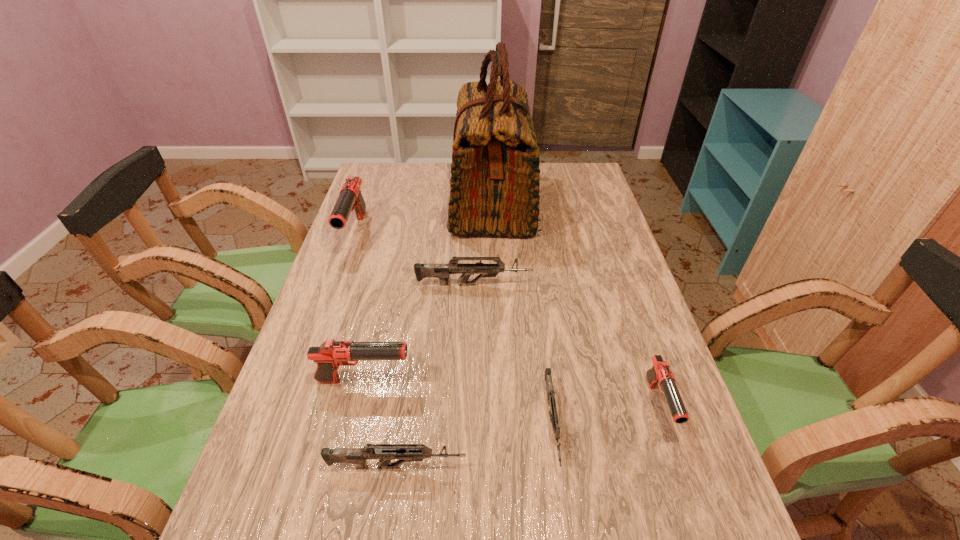
Identify the location of the second smallest grey gun. (385, 453).

Locate an element on the screen. The height and width of the screenshot is (540, 960). the rightmost grey gun is located at coordinates (553, 415).

Identify the location of the shortest object. The width and height of the screenshot is (960, 540). (553, 415).

Where is `vacant area situated on the open handle side of the shopping bag`? vacant area situated on the open handle side of the shopping bag is located at coordinates (403, 202).

This screenshot has width=960, height=540. Find the location of `vacant space positioned on the open handle side of the shopping bag`. vacant space positioned on the open handle side of the shopping bag is located at coordinates (372, 202).

This screenshot has height=540, width=960. I want to click on vacant space located 0.270m on the open handle side of the shopping bag, so click(372, 202).

Locate an element on the screen. The width and height of the screenshot is (960, 540). vacant space located 0.400m at the aiming end of the biggest black gun is located at coordinates (307, 369).

This screenshot has height=540, width=960. What are the coordinates of `free space located 0.060m at the aiming end of the second biggest black gun` in the screenshot? It's located at click(438, 380).

Locate an element on the screen. This screenshot has width=960, height=540. vacant region located at the aiming end of the smallest black gun is located at coordinates (701, 533).

This screenshot has width=960, height=540. Identify the location of free region located aimed along the barrel of the third farthest object. (588, 285).